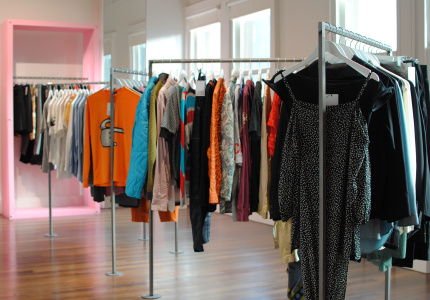
Locate an element on the screen. The height and width of the screenshot is (300, 430). pink wall frame is located at coordinates (89, 35), (9, 49).